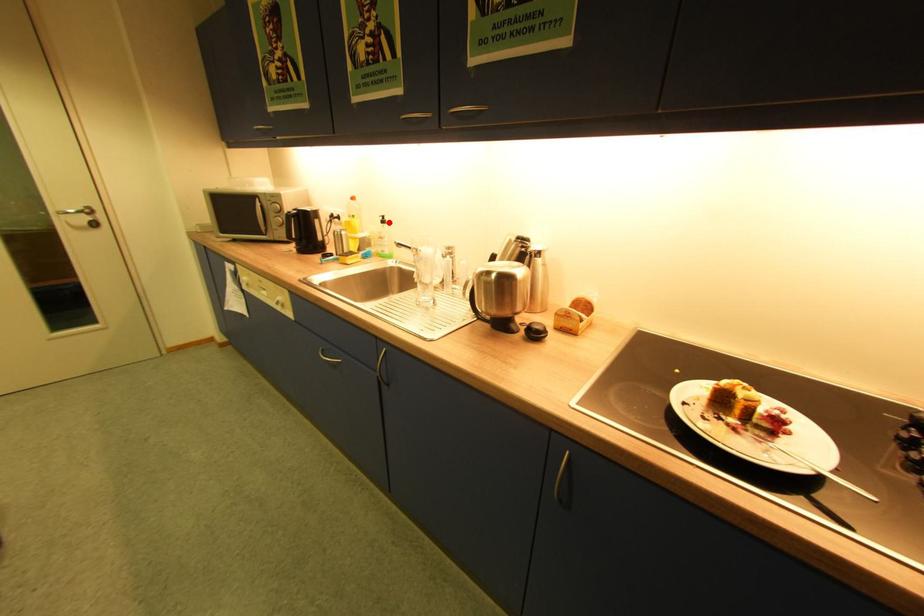
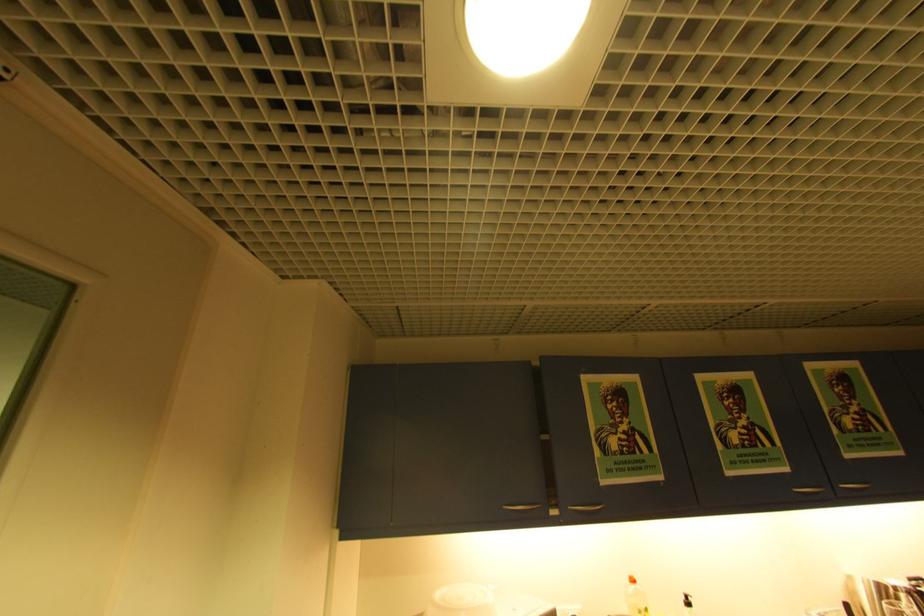
Question: A red point is marked in image1. In image2, is the corresponding 3D point closer to the camera or farther? Reply with the corresponding letter.

Choices:
 (A) The corresponding 3D point is closer.
 (B) The corresponding 3D point is farther.

Answer: (A)